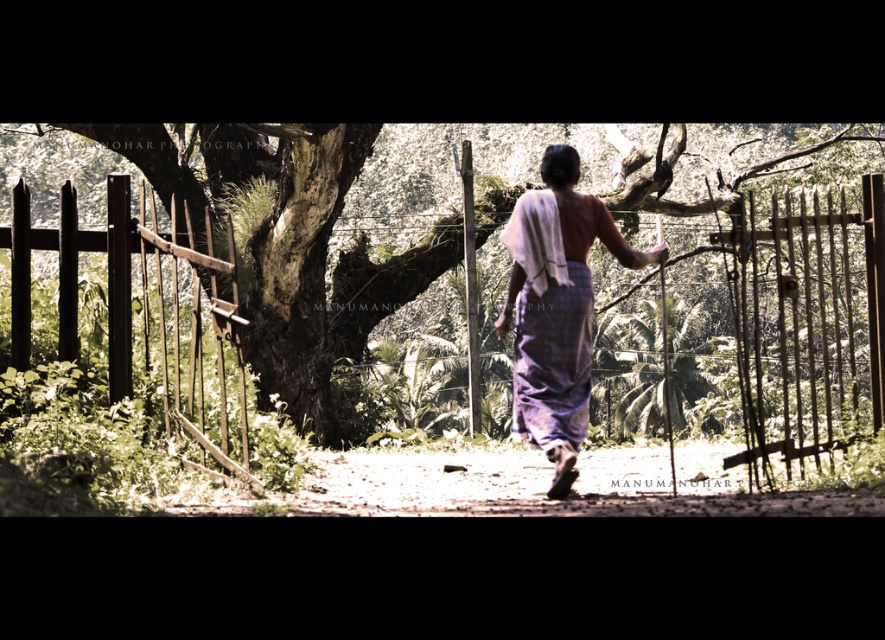
Is smooth bark tree at center shorter than purple checkered dress at center?

No.

The image size is (885, 640). In order to click on smooth bark tree at center in this screenshot , I will do [x=289, y=240].

Is smooth bark tree at center smaller than dark brown wooden fence at left?

Actually, smooth bark tree at center might be larger than dark brown wooden fence at left.

Between smooth bark tree at center and dark brown wooden fence at left, which one is positioned higher?

smooth bark tree at center is higher up.

What do you see at coordinates (289, 240) in the screenshot? I see `smooth bark tree at center` at bounding box center [289, 240].

Locate an element on the screen. This screenshot has width=885, height=640. smooth bark tree at center is located at coordinates (289, 240).

Is point (793, 513) positioned before point (586, 369)?

Yes, point (793, 513) is in front of point (586, 369).

Measure the distance between dirt ground at center and purple checkered dress at center.

The distance of dirt ground at center from purple checkered dress at center is 2.06 meters.

Who is more forward, [328,515] or [517,353]?

Point [328,515] is more forward.

Image resolution: width=885 pixels, height=640 pixels. I want to click on dirt ground at center, so click(537, 484).